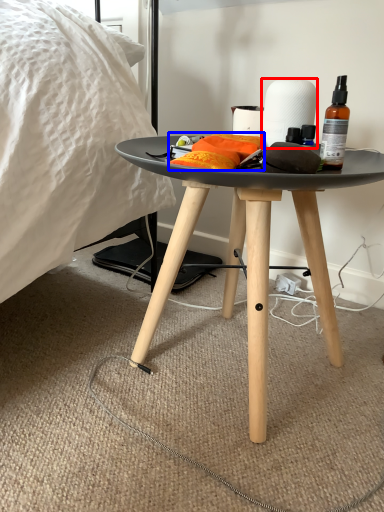
Question: Which object appears farthest to the camera in this image, paper towel (highlighted by a red box) or material (highlighted by a blue box)?

Choices:
 (A) paper towel
 (B) material

Answer: (A)